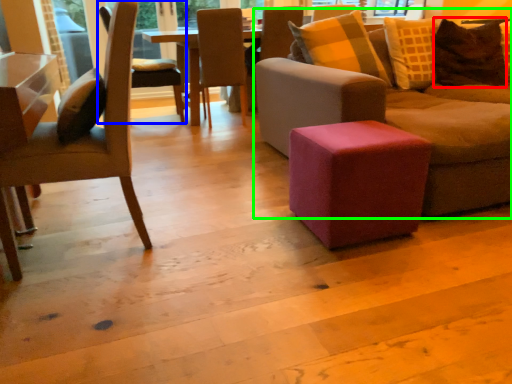
Question: Based on their relative distances, which object is farther from pillow (highlighted by a red box)? Choose from chair (highlighted by a blue box) and studio couch (highlighted by a green box).

Choices:
 (A) chair
 (B) studio couch

Answer: (A)